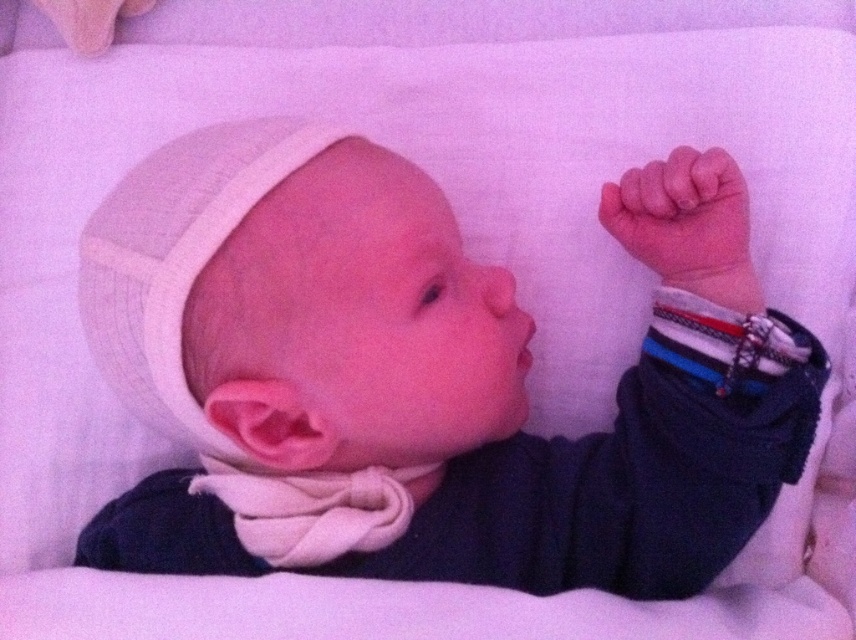
Question: Which point appears farthest from the camera in this image?

Choices:
 (A) (682, 198)
 (B) (554, 525)

Answer: (B)

Question: Can you confirm if white knit hat at upper left is thinner than rubber teething ring at upper right?

Choices:
 (A) yes
 (B) no

Answer: (B)

Question: Among these points, which one is nearest to the camera?

Choices:
 (A) (697, 200)
 (B) (411, 566)

Answer: (A)

Question: Does white knit hat at upper left appear under rubber teething ring at upper right?

Choices:
 (A) no
 (B) yes

Answer: (B)

Question: Which point is farther to the camera?

Choices:
 (A) (773, 381)
 (B) (678, 209)

Answer: (B)

Question: Is white knit hat at upper left below rubber teething ring at upper right?

Choices:
 (A) yes
 (B) no

Answer: (A)